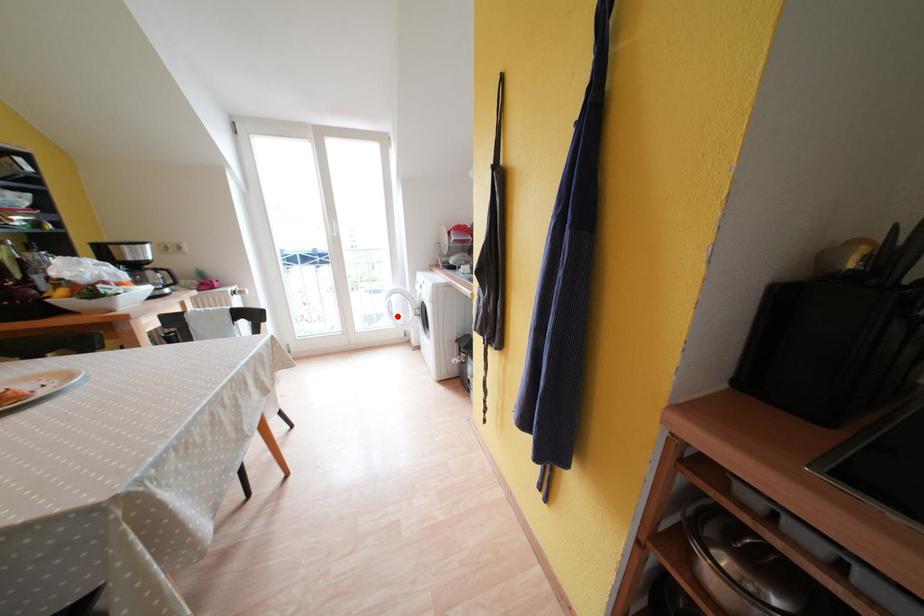
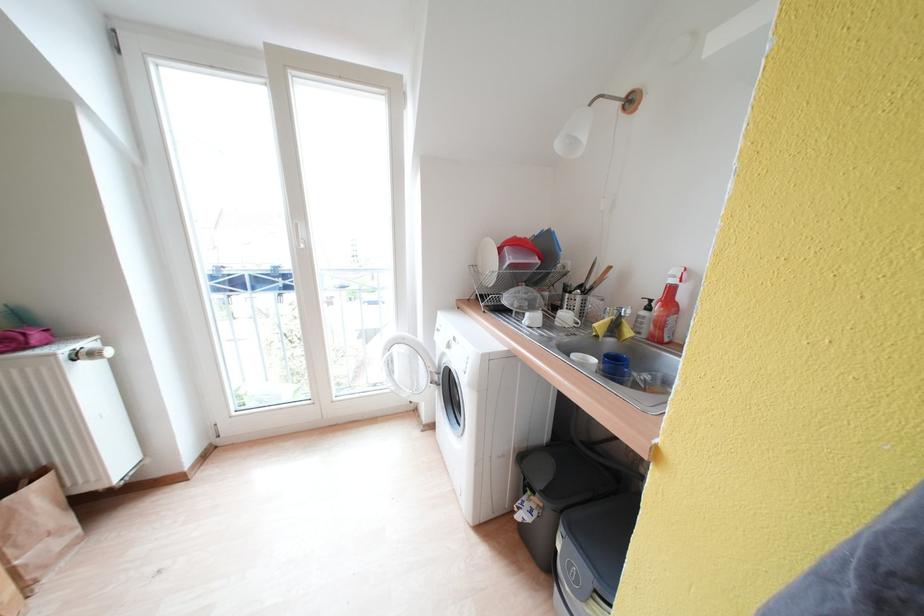
Locate, in the second image, the point that corresponds to the highlighted location in the first image.

(397, 376)